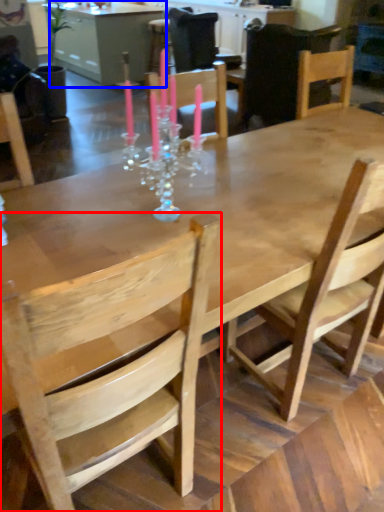
Question: Among these objects, which one is farthest to the camera, chair (highlighted by a red box) or table (highlighted by a blue box)?

Choices:
 (A) chair
 (B) table

Answer: (B)